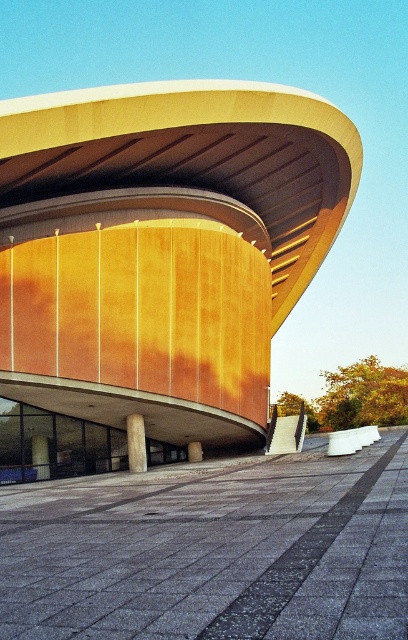
Question: Which object is the farthest from the wooden paneling at center?

Choices:
 (A) smooth concrete pillar at center
 (B) smooth wood pillar at center
 (C) wooden pillar at center

Answer: (C)

Question: Among these objects, which one is nearest to the camera?

Choices:
 (A) wooden paneling at center
 (B) wooden pillar at center
 (C) smooth wood pillar at center

Answer: (A)

Question: Is wooden paneling at center to the right of smooth wood pillar at center from the viewer's perspective?

Choices:
 (A) no
 (B) yes

Answer: (B)

Question: Which of these objects is positioned farthest from the smooth wood pillar at center?

Choices:
 (A) wooden paneling at center
 (B) wooden pillar at center
 (C) smooth concrete pillar at center

Answer: (A)

Question: Does wooden paneling at center have a smaller size compared to smooth concrete pillar at center?

Choices:
 (A) yes
 (B) no

Answer: (B)

Question: Does wooden paneling at center appear on the left side of wooden pillar at center?

Choices:
 (A) no
 (B) yes

Answer: (A)